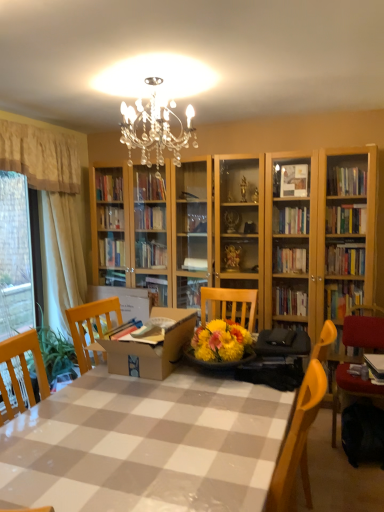
The height and width of the screenshot is (512, 384). Describe the element at coordinates (62, 258) in the screenshot. I see `beige fabric curtain at left, the 3th curtain when ordered from left to right` at that location.

Find the location of a particular element. Image resolution: width=384 pixels, height=512 pixels. checkered plastic table at center is located at coordinates (145, 445).

Find the location of a particular element. This screenshot has height=512, width=384. white sheer curtain at left, acting as the first curtain starting from the left is located at coordinates (52, 209).

Does beige fabric curtain at left, marked as the 2th curtain in a left-to-right arrangement, have a smaller size compared to white sheer curtain at left, acting as the first curtain starting from the left?

Yes.

Consider the image. How many degrees apart are the facing directions of beige fabric curtain at left, marked as the second curtain in a right-to-left arrangement, and white sheer curtain at left, which is the third curtain from right to left?

There is a 2.61-degree angle between the facing directions of beige fabric curtain at left, marked as the second curtain in a right-to-left arrangement, and white sheer curtain at left, which is the third curtain from right to left.

Considering the relative positions of beige fabric curtain at left, marked as the 2th curtain in a left-to-right arrangement, and white sheer curtain at left, which is the third curtain from right to left, in the image provided, is beige fabric curtain at left, marked as the 2th curtain in a left-to-right arrangement, to the left of white sheer curtain at left, which is the third curtain from right to left, from the viewer's perspective?

Incorrect, beige fabric curtain at left, marked as the 2th curtain in a left-to-right arrangement, is not on the left side of white sheer curtain at left, which is the third curtain from right to left.

Consider the image. Is beige fabric curtain at left, marked as the second curtain in a right-to-left arrangement, taller than white sheer curtain at left, which is the third curtain from right to left?

No.

Is point (56, 285) closer or farther from the camera than point (78, 207)?

Point (56, 285) is closer to the camera than point (78, 207).

Can you confirm if beige fabric curtain at left, the 3th curtain when ordered from left to right, is bigger than white sheer curtain at left, which is the third curtain from right to left?

Actually, beige fabric curtain at left, the 3th curtain when ordered from left to right, might be smaller than white sheer curtain at left, which is the third curtain from right to left.

From a real-world perspective, is beige fabric curtain at left, placed as the first curtain when sorted from right to left, under white sheer curtain at left, which is the third curtain from right to left?

No, from a real-world perspective, beige fabric curtain at left, placed as the first curtain when sorted from right to left, is not under white sheer curtain at left, which is the third curtain from right to left.

Between cardboard box at center and beige fabric curtain at left, marked as the 2th curtain in a left-to-right arrangement, which one appears on the right side from the viewer's perspective?

cardboard box at center.

How much distance is there between cardboard box at center and beige fabric curtain at left, marked as the second curtain in a right-to-left arrangement?

cardboard box at center is 5.30 feet from beige fabric curtain at left, marked as the second curtain in a right-to-left arrangement.

Is point (113, 344) positioned behind point (39, 136)?

No, (113, 344) is in front of (39, 136).

Which object is further away from the camera taking this photo, cardboard box at center or beige fabric curtain at left, marked as the second curtain in a right-to-left arrangement?

beige fabric curtain at left, marked as the second curtain in a right-to-left arrangement, is more distant.

Are beige fabric curtain at left, marked as the 2th curtain in a left-to-right arrangement, and cardboard box at center beside each other?

No, beige fabric curtain at left, marked as the 2th curtain in a left-to-right arrangement, is not with cardboard box at center.

From the image's perspective, which is above, beige fabric curtain at left, marked as the second curtain in a right-to-left arrangement, or cardboard box at center?

beige fabric curtain at left, marked as the second curtain in a right-to-left arrangement.

From a real-world perspective, who is located higher, beige fabric curtain at left, marked as the second curtain in a right-to-left arrangement, or cardboard box at center?

beige fabric curtain at left, marked as the second curtain in a right-to-left arrangement, from a real-world perspective.

Which of these two, beige fabric curtain at left, marked as the second curtain in a right-to-left arrangement, or cardboard box at center, is wider?

Wider between the two is cardboard box at center.

From a real-world perspective, relative to velvet red chair at lower right, is beige fabric curtain at left, placed as the first curtain when sorted from right to left, vertically above or below?

In terms of real-world spatial position, beige fabric curtain at left, placed as the first curtain when sorted from right to left, is above velvet red chair at lower right.

In terms of size, does beige fabric curtain at left, placed as the first curtain when sorted from right to left, appear bigger or smaller than velvet red chair at lower right?

In the image, beige fabric curtain at left, placed as the first curtain when sorted from right to left, appears to be larger than velvet red chair at lower right.

Can you confirm if beige fabric curtain at left, placed as the first curtain when sorted from right to left, is shorter than velvet red chair at lower right?

No.

Is beige fabric curtain at left, placed as the first curtain when sorted from right to left, to the left or to the right of velvet red chair at lower right in the image?

Clearly, beige fabric curtain at left, placed as the first curtain when sorted from right to left, is on the left of velvet red chair at lower right in the image.

How much distance is there between checkered plastic table at center and cardboard box at center?

The distance of checkered plastic table at center from cardboard box at center is 18.74 inches.

Which is further, (218, 419) or (131, 362)?

The point (131, 362) is farther from the camera.

In the scene shown: How many degrees apart are the facing directions of checkered plastic table at center and cardboard box at center?

89.9 degrees separate the facing orientations of checkered plastic table at center and cardboard box at center.

Choose the correct answer: Is checkered plastic table at center inside cardboard box at center or outside it?

checkered plastic table at center exists outside the volume of cardboard box at center.

Is beige fabric curtain at left, marked as the second curtain in a right-to-left arrangement, completely or partially outside of beige fabric curtain at left, placed as the first curtain when sorted from right to left?

beige fabric curtain at left, marked as the second curtain in a right-to-left arrangement, lies outside beige fabric curtain at left, placed as the first curtain when sorted from right to left,'s area.

Which object is wider, beige fabric curtain at left, marked as the second curtain in a right-to-left arrangement, or beige fabric curtain at left, the 3th curtain when ordered from left to right?

With larger width is beige fabric curtain at left, marked as the second curtain in a right-to-left arrangement.

Considering the relative positions of beige fabric curtain at left, marked as the 2th curtain in a left-to-right arrangement, and beige fabric curtain at left, placed as the first curtain when sorted from right to left, in the image provided, is beige fabric curtain at left, marked as the 2th curtain in a left-to-right arrangement, in front of beige fabric curtain at left, placed as the first curtain when sorted from right to left,?

Yes, beige fabric curtain at left, marked as the 2th curtain in a left-to-right arrangement, is closer to the camera.

There is a white sheer curtain at left, acting as the first curtain starting from the left. Identify the location of the 2nd curtain above it (from a real-world perspective). coord(40,157).

Identify the location of the 1st curtain above when counting from the white sheer curtain at left, which is the third curtain from right to left (from the image's perspective). (62, 258).

Considering their positions, is velvet red chair at lower right positioned further to checkered plastic table at center than cardboard box at center?

Based on the image, velvet red chair at lower right appears to be further to checkered plastic table at center.

Based on their spatial positions, is velvet red chair at lower right or white sheer curtain at left, acting as the first curtain starting from the left, closer to beige fabric curtain at left, marked as the 2th curtain in a left-to-right arrangement?

Among the two, white sheer curtain at left, acting as the first curtain starting from the left, is located nearer to beige fabric curtain at left, marked as the 2th curtain in a left-to-right arrangement.

From the image, which object appears to be farther from beige fabric curtain at left, placed as the first curtain when sorted from right to left, cardboard box at center or beige fabric curtain at left, marked as the second curtain in a right-to-left arrangement?

The object further to beige fabric curtain at left, placed as the first curtain when sorted from right to left, is cardboard box at center.

Estimate the real-world distances between objects in this image. Which object is closer to beige fabric curtain at left, marked as the 2th curtain in a left-to-right arrangement, white sheer curtain at left, acting as the first curtain starting from the left, or checkered plastic table at center?

white sheer curtain at left, acting as the first curtain starting from the left, is positioned closer to the anchor beige fabric curtain at left, marked as the 2th curtain in a left-to-right arrangement.

From the image, which object appears to be nearer to velvet red chair at lower right, beige fabric curtain at left, marked as the second curtain in a right-to-left arrangement, or cardboard box at center?

The object closer to velvet red chair at lower right is cardboard box at center.

Based on the photo, which object lies nearer to the anchor point cardboard box at center, beige fabric curtain at left, the 3th curtain when ordered from left to right, or white sheer curtain at left, which is the third curtain from right to left?

The object closer to cardboard box at center is beige fabric curtain at left, the 3th curtain when ordered from left to right.

Based on their spatial positions, is velvet red chair at lower right or beige fabric curtain at left, marked as the second curtain in a right-to-left arrangement, closer to white sheer curtain at left, acting as the first curtain starting from the left?

beige fabric curtain at left, marked as the second curtain in a right-to-left arrangement, is closer to white sheer curtain at left, acting as the first curtain starting from the left.

Looking at the image, which one is located further to white sheer curtain at left, acting as the first curtain starting from the left, velvet red chair at lower right or beige fabric curtain at left, placed as the first curtain when sorted from right to left?

velvet red chair at lower right is positioned further to the anchor white sheer curtain at left, acting as the first curtain starting from the left.

You are a GUI agent. You are given a task and a screenshot of the screen. Output one action in this format:
    pyautogui.click(x=<x>, y=<y>)
    Task: Click on the cardboard box between beige fabric curtain at left, marked as the second curtain in a right-to-left arrangement, and velvet red chair at lower right from left to right
    The height and width of the screenshot is (512, 384).
    Given the screenshot: What is the action you would take?
    pyautogui.click(x=152, y=347)

Where is `cardboard box between white sheer curtain at left, which is the third curtain from right to left, and velvet red chair at lower right, in the horizontal direction`? This screenshot has height=512, width=384. cardboard box between white sheer curtain at left, which is the third curtain from right to left, and velvet red chair at lower right, in the horizontal direction is located at coordinates (152, 347).

Locate an element on the screen. cardboard box between checkered plastic table at center and white sheer curtain at left, which is the third curtain from right to left, from front to back is located at coordinates (152, 347).

What are the coordinates of `table between white sheer curtain at left, acting as the first curtain starting from the left, and velvet red chair at lower right` in the screenshot? It's located at (145, 445).